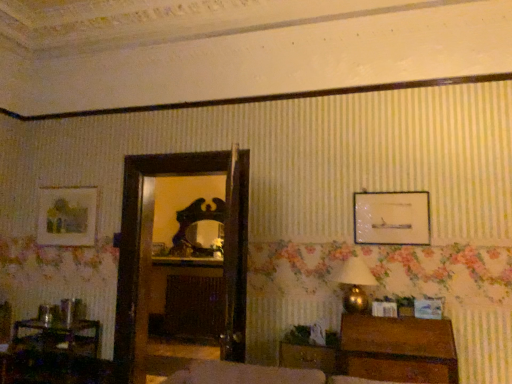
Question: Considering the positions of wooden drawer at lower right and gold metallic table lamp at right in the image, is wooden drawer at lower right bigger or smaller than gold metallic table lamp at right?

Choices:
 (A) big
 (B) small

Answer: (B)

Question: Is wooden drawer at lower right inside or outside of gold metallic table lamp at right?

Choices:
 (A) inside
 (B) outside

Answer: (B)

Question: Considering the real-world distances, which object is closest to the wooden drawer at lower right?

Choices:
 (A) wooden chest at lower right
 (B) matte glass picture frame at upper right, the first picture frame in the right-to-left sequence
 (C) shiny dark wood mirror at center
 (D) wooden table at lower left
 (E) gold metallic table lamp at right

Answer: (A)

Question: Based on their relative distances, which object is nearer to the gold metallic table lamp at right?

Choices:
 (A) matte wooden picture frame at upper left, positioned as the second picture frame in back-to-front order
 (B) wooden chest at lower right
 (C) wooden picture frame at center, positioned as the third picture frame in front-to-back order
 (D) matte glass picture frame at upper right, the 3th picture frame in the left-to-right sequence
 (E) wooden drawer at lower right

Answer: (B)